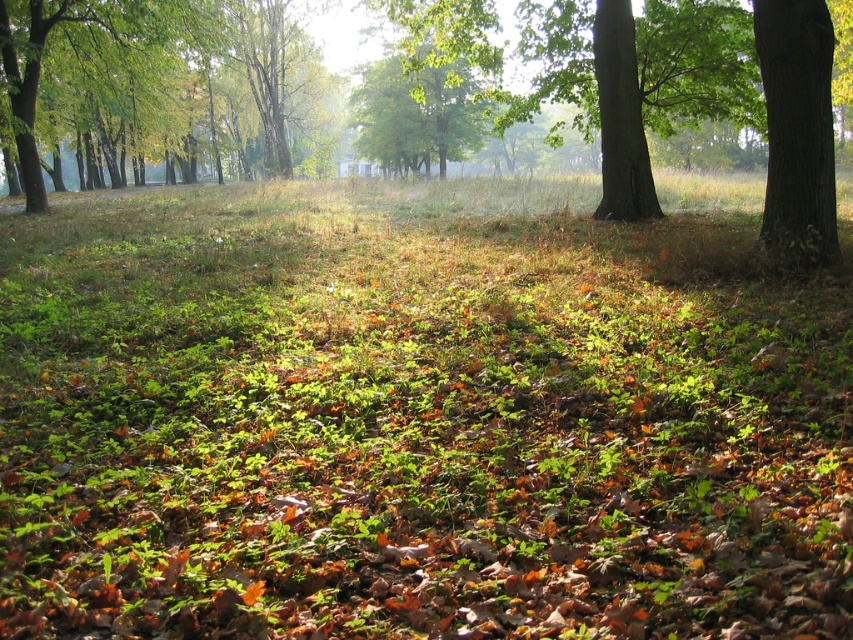
Is green leafy grass at center positioned in front of green rough bark tree at right?

Yes, green leafy grass at center is in front of green rough bark tree at right.

Looking at this image, is green leafy grass at center wider than green rough bark tree at right?

Indeed, green leafy grass at center has a greater width compared to green rough bark tree at right.

Identify the location of green leafy grass at center. coord(421,413).

Which of these two, green leafy grass at center or green leafy tree at left, stands taller?

green leafy tree at left is taller.

Can you confirm if green leafy grass at center is wider than green leafy tree at left?

Yes.

You are a GUI agent. You are given a task and a screenshot of the screen. Output one action in this format:
    pyautogui.click(x=<x>, y=<y>)
    Task: Click on the green leafy grass at center
    
    Given the screenshot: What is the action you would take?
    pyautogui.click(x=421, y=413)

Find the location of a particular element. green leafy grass at center is located at coordinates (421, 413).

Is green rough bark tree at right positioned at the back of green leafy tree at left?

No, green rough bark tree at right is in front of green leafy tree at left.

Can you confirm if green rough bark tree at right is positioned below green leafy tree at left?

Indeed, green rough bark tree at right is positioned under green leafy tree at left.

Locate an element on the screen. This screenshot has width=853, height=640. green rough bark tree at right is located at coordinates (798, 129).

The height and width of the screenshot is (640, 853). Identify the location of green rough bark tree at right. (798, 129).